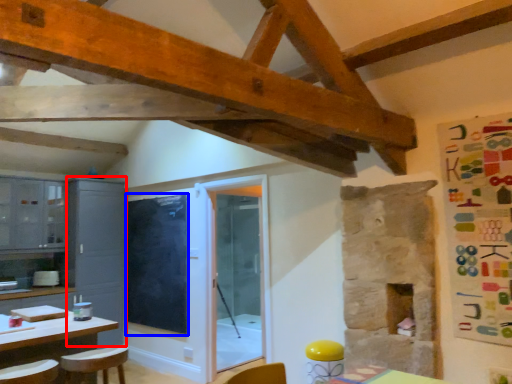
Question: Which object appears farthest to the camera in this image, cabinetry (highlighted by a red box) or window screen (highlighted by a blue box)?

Choices:
 (A) cabinetry
 (B) window screen

Answer: (A)